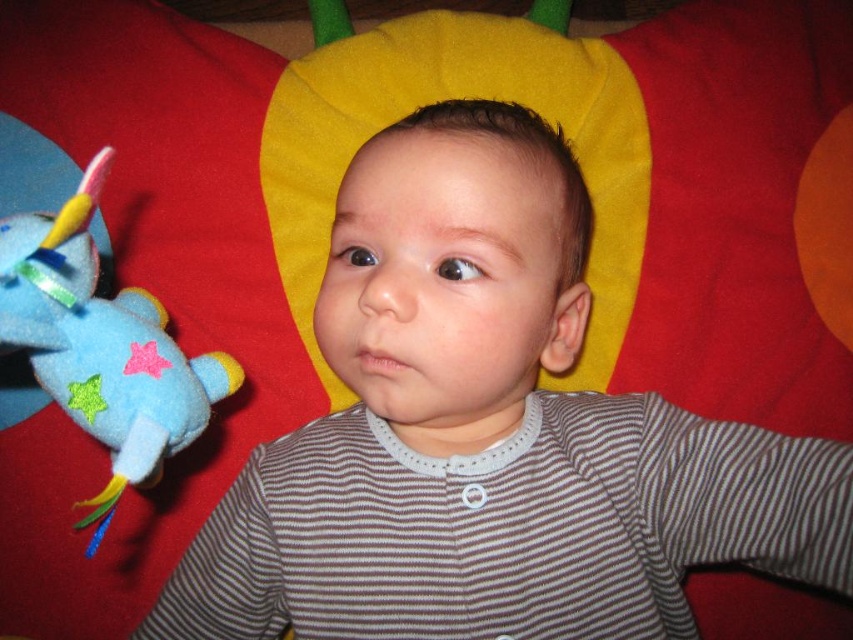
Question: Is gray striped shirt at center below blue felt airplane at left?

Choices:
 (A) yes
 (B) no

Answer: (A)

Question: From the image, what is the correct spatial relationship of gray striped shirt at center in relation to blue felt airplane at left?

Choices:
 (A) below
 (B) above

Answer: (A)

Question: Which point is closer to the camera taking this photo?

Choices:
 (A) coord(85,257)
 (B) coord(808,445)

Answer: (A)

Question: Is gray striped shirt at center bigger than blue felt airplane at left?

Choices:
 (A) no
 (B) yes

Answer: (B)

Question: Which point is farther to the camera?

Choices:
 (A) blue felt airplane at left
 (B) gray striped shirt at center

Answer: (A)